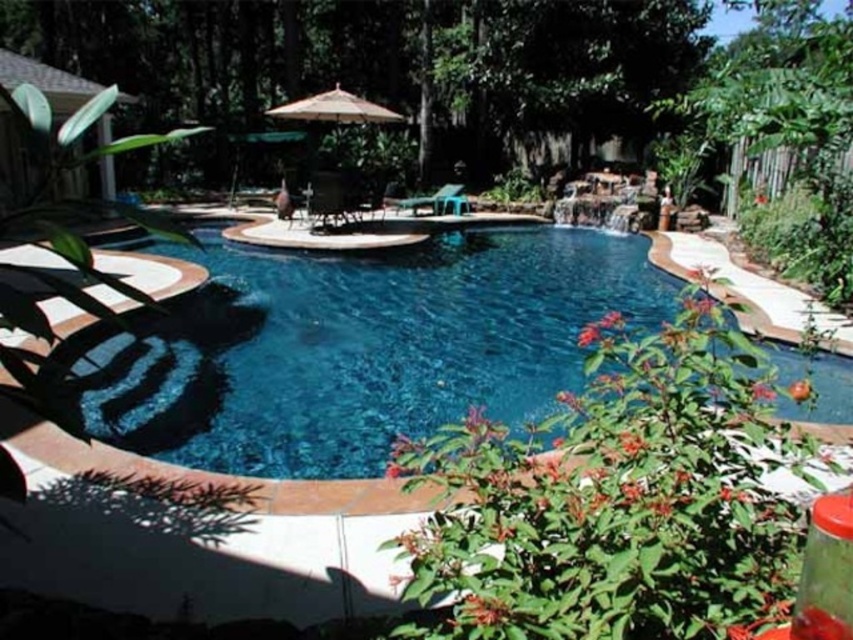
You are planning to host a dinner party in the backyard and want to ensure there is enough space between the beige fabric umbrella at center and the metallic green chair at center for guests to walk comfortably. According to the scene, which object is on the left, and is there enough space between them for a guest to pass through?

The beige fabric umbrella at center is positioned on the left side of the metallic green chair at center. However, the exact distance between them isn

You are planning to host a small gathering in the backyard and want to ensure there is enough space for both the beige fabric umbrella at center and the metallic green chair at center. Based on their sizes, which one requires more space to accommodate?

The beige fabric umbrella at center is larger in size than the metallic green chair at center, so it requires more space to accommodate.

You are planning to place a new potted plant between the beige fabric umbrella at center and the black plastic chair at center in the backyard. The potted plant has a width of 2 feet. Is there enough space between them to fit the plant without moving either the umbrella or the chair?

The beige fabric umbrella at center and black plastic chair at center are 6.22 feet apart. Since the potted plant is only 2 feet wide, there is sufficient space between them to accommodate it without needing to move either object.